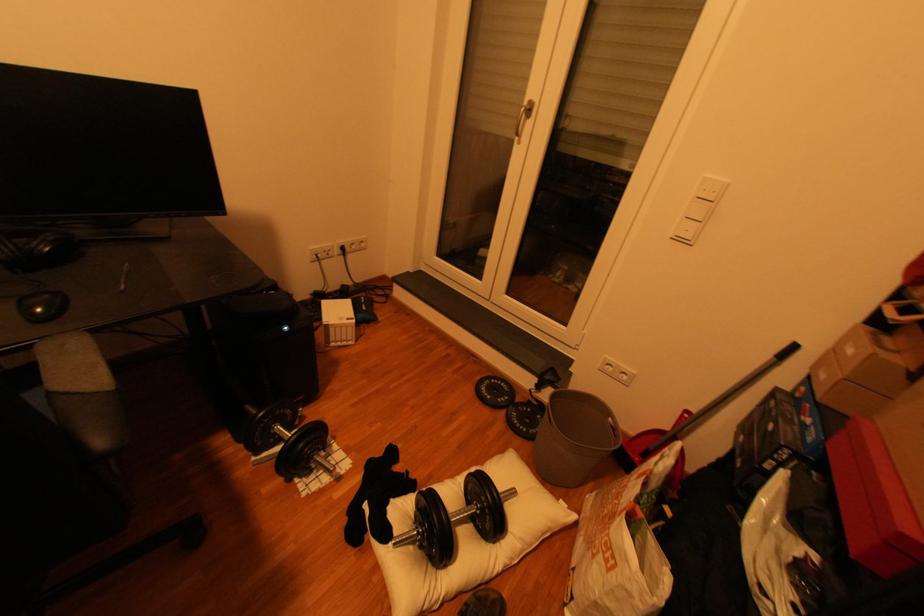
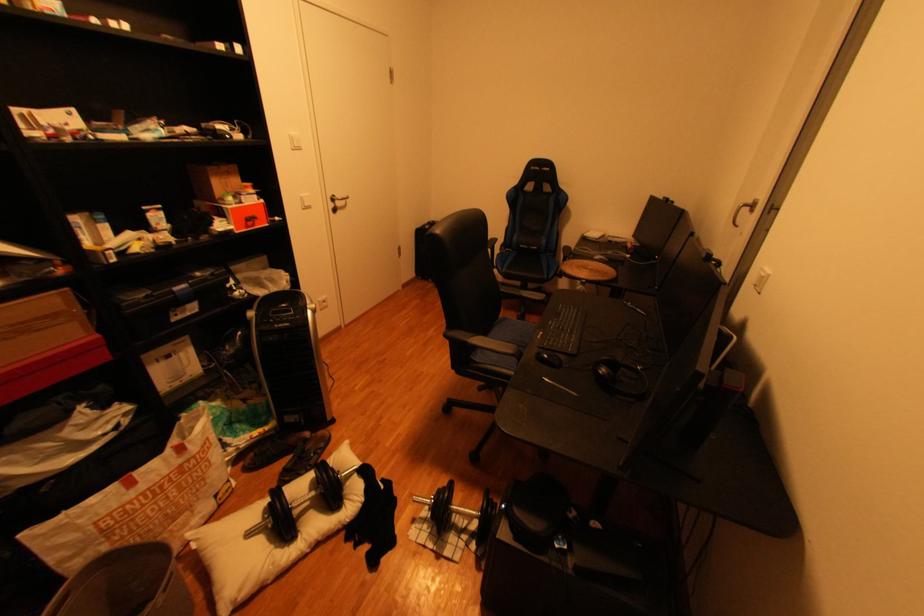
The point at [47,310] is marked in the first image. Where is the corresponding point in the second image?

(554, 355)